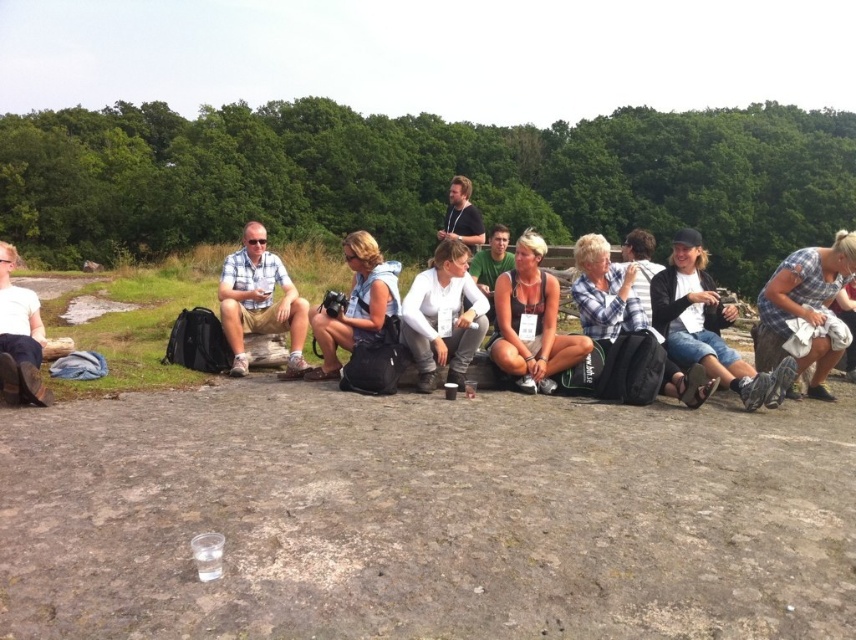
Question: Estimate the real-world distances between objects in this image. Which object is farther from the white matte shirt at center?

Choices:
 (A) plaid fabric dress at right
 (B) matte white tank top at center
 (C) light blue shirt at center

Answer: (A)

Question: Which point is closer to the camera?

Choices:
 (A) (685, 346)
 (B) (544, 252)
 (C) (842, 241)

Answer: (C)

Question: From the image, what is the correct spatial relationship of white matte shirt at center in relation to light blue shirt at center?

Choices:
 (A) below
 (B) above

Answer: (A)

Question: Does white matte shirt at center have a greater width compared to matte black boots at lower left?

Choices:
 (A) yes
 (B) no

Answer: (B)

Question: Can you confirm if plaid fabric dress at right is positioned above matte white tank top at center?

Choices:
 (A) yes
 (B) no

Answer: (A)

Question: Which point is closer to the camera taking this photo?

Choices:
 (A) (513, 284)
 (B) (839, 288)
 (C) (223, 294)

Answer: (B)